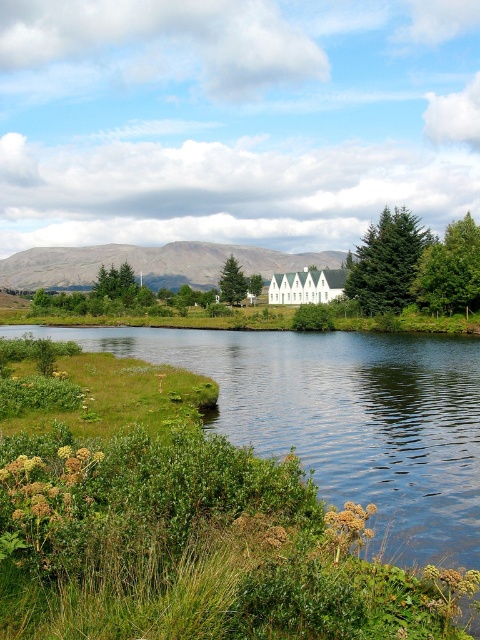
You are standing at the center of the image and want to walk towards the green grassy river at lower center. According to the coordinates provided, in which direction should you move relative to your current position?

The green grassy river at lower center is located at point (343, 419), which means you should move downward and to the right from your current position at the center to reach it.

Based on the photo, you are standing at the point marked as point (x=343, y=419) in the image. What type of terrain are you currently standing on?

The point (x=343, y=419) is on green grassy river at lower center, so you are standing on a green grassy river.